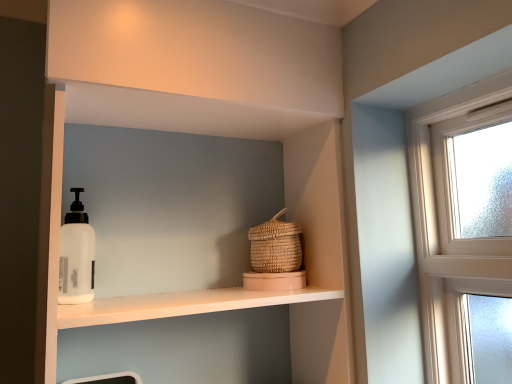
What do you see at coordinates (287, 217) in the screenshot? I see `white matte shelf at center` at bounding box center [287, 217].

Identify the location of white matte shelf at center. The image size is (512, 384). (287, 217).

What do you see at coordinates (275, 246) in the screenshot?
I see `woven straw basket at center` at bounding box center [275, 246].

At what (x,y) coordinates should I click in order to perform the action: click on woven straw basket at center. Please return your answer as a coordinate pair (x, y). Looking at the image, I should click on click(275, 246).

What is the approximate height of woven straw basket at center?

woven straw basket at center is 7.52 inches in height.

Locate an element on the screen. The height and width of the screenshot is (384, 512). white matte shelf at center is located at coordinates (287, 217).

Which is more to the left, woven straw basket at center or white matte shelf at center?

white matte shelf at center.

Is woven straw basket at center in front of or behind white matte shelf at center in the image?

Visually, woven straw basket at center is located behind white matte shelf at center.

Does point (248, 235) come closer to viewer compared to point (150, 302)?

No, it is behind (150, 302).

From the image's perspective, does woven straw basket at center appear higher than white matte shelf at center?

Yes, from the image's perspective, woven straw basket at center is above white matte shelf at center.

Looking at this image, from a real-world perspective, between woven straw basket at center and white matte shelf at center, who is vertically lower?

white matte shelf at center.

Does woven straw basket at center have a greater width compared to white matte shelf at center?

Incorrect, the width of woven straw basket at center does not surpass that of white matte shelf at center.

Which of these two, woven straw basket at center or white matte shelf at center, stands taller?

With more height is white matte shelf at center.

Does woven straw basket at center have a smaller size compared to white matte shelf at center?

Indeed, woven straw basket at center has a smaller size compared to white matte shelf at center.

Is woven straw basket at center positioned beyond the bounds of white matte shelf at center?

No.

Is woven straw basket at center in contact with white matte shelf at center?

They are not placed beside each other.

Is woven straw basket at center oriented away from white matte shelf at center?

Correct, woven straw basket at center is looking away from white matte shelf at center.

Measure the distance between woven straw basket at center and white matte shelf at center.

woven straw basket at center and white matte shelf at center are 7.12 inches apart.

Where is `shelf in front of the woven straw basket at center`? The width and height of the screenshot is (512, 384). shelf in front of the woven straw basket at center is located at coordinates (287, 217).

Considering the positions of objects white matte shelf at center and woven straw basket at center in the image provided, who is more to the right, white matte shelf at center or woven straw basket at center?

woven straw basket at center.

Considering the relative positions of white matte shelf at center and woven straw basket at center in the image provided, is white matte shelf at center in front of woven straw basket at center?

Yes, white matte shelf at center is in front of woven straw basket at center.

Is point (297, 170) positioned before point (281, 237)?

No.

From the image's perspective, would you say white matte shelf at center is shown under woven straw basket at center?

Yes, from the image's perspective, white matte shelf at center is below woven straw basket at center.

From a real-world perspective, is white matte shelf at center over woven straw basket at center?

No, from a real-world perspective, white matte shelf at center is not over woven straw basket at center

Which object is wider, white matte shelf at center or woven straw basket at center?

white matte shelf at center is wider.

Is white matte shelf at center shorter than woven straw basket at center?

In fact, white matte shelf at center may be taller than woven straw basket at center.

Considering the relative sizes of white matte shelf at center and woven straw basket at center in the image provided, is white matte shelf at center smaller than woven straw basket at center?

No.

Is white matte shelf at center spatially inside woven straw basket at center, or outside of it?

The correct answer is: outside.

Is the surface of white matte shelf at center in direct contact with woven straw basket at center?

They are not placed beside each other.

Is white matte shelf at center aimed at woven straw basket at center?

Yes, white matte shelf at center faces towards woven straw basket at center.

How different are the orientations of white matte shelf at center and woven straw basket at center in degrees?

The angle between the facing direction of white matte shelf at center and the facing direction of woven straw basket at center is 1.49 degrees.

Image resolution: width=512 pixels, height=384 pixels. I want to click on basket lying behind the white matte shelf at center, so click(x=275, y=246).

At what (x,y) coordinates should I click in order to perform the action: click on basket located behind the white matte shelf at center. Please return your answer as a coordinate pair (x, y). The image size is (512, 384). Looking at the image, I should click on [x=275, y=246].

Image resolution: width=512 pixels, height=384 pixels. What are the coordinates of `basket on the right of white matte shelf at center` in the screenshot? It's located at (275, 246).